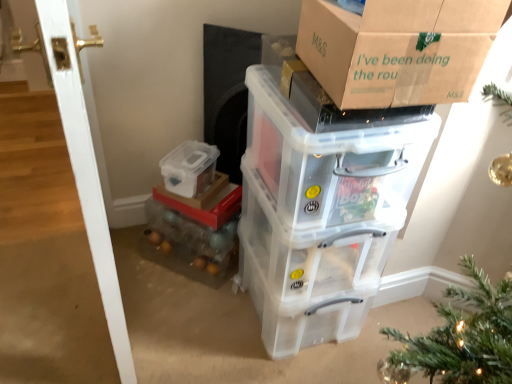
Question: Which direction should I rotate to look at transparent plastic storage box at lower center, which ranks as the 3th storage box in bottom-to-top order, — up or down?

Choices:
 (A) down
 (B) up

Answer: (B)

Question: From a real-world perspective, is transparent plastic storage box at center, which is the 4th storage box in top-to-bottom order, physically below white glossy door at left?

Choices:
 (A) yes
 (B) no

Answer: (A)

Question: From the image's perspective, is transparent plastic storage box at center, which is counted as the first storage box, starting from the bottom, below white glossy door at left?

Choices:
 (A) yes
 (B) no

Answer: (A)

Question: Is transparent plastic storage box at center, which is the 4th storage box in top-to-bottom order, shorter than white glossy door at left?

Choices:
 (A) no
 (B) yes

Answer: (B)

Question: From a real-world perspective, is transparent plastic storage box at center, which is counted as the first storage box, starting from the bottom, positioned over white glossy door at left based on gravity?

Choices:
 (A) no
 (B) yes

Answer: (A)

Question: Can we say transparent plastic storage box at center, which is counted as the first storage box, starting from the bottom, lies outside white glossy door at left?

Choices:
 (A) no
 (B) yes

Answer: (B)

Question: Can you confirm if transparent plastic storage box at center, which is counted as the first storage box, starting from the bottom, is bigger than white glossy door at left?

Choices:
 (A) yes
 (B) no

Answer: (B)

Question: Considering the relative sizes of transparent plastic storage box at upper right, acting as the first storage box starting from the top, and transparent plastic storage box at center, which is the 4th storage box in top-to-bottom order, in the image provided, is transparent plastic storage box at upper right, acting as the first storage box starting from the top, bigger than transparent plastic storage box at center, which is the 4th storage box in top-to-bottom order,?

Choices:
 (A) yes
 (B) no

Answer: (A)

Question: From the image's perspective, is transparent plastic storage box at upper right, marked as the fourth storage box in a bottom-to-top arrangement, under transparent plastic storage box at center, which is counted as the first storage box, starting from the bottom?

Choices:
 (A) no
 (B) yes

Answer: (A)

Question: Could you tell me if transparent plastic storage box at upper right, acting as the first storage box starting from the top, is turned towards transparent plastic storage box at center, which is the 4th storage box in top-to-bottom order?

Choices:
 (A) yes
 (B) no

Answer: (B)

Question: Is transparent plastic storage box at center, which is the 4th storage box in top-to-bottom order, at the back of transparent plastic storage box at upper right, acting as the first storage box starting from the top?

Choices:
 (A) yes
 (B) no

Answer: (B)

Question: Is transparent plastic storage box at upper right, marked as the fourth storage box in a bottom-to-top arrangement, next to transparent plastic storage box at center, which is counted as the first storage box, starting from the bottom, and touching it?

Choices:
 (A) yes
 (B) no

Answer: (B)

Question: Does transparent plastic storage box at upper right, acting as the first storage box starting from the top, have a lesser width compared to transparent plastic storage box at center, which is the 4th storage box in top-to-bottom order?

Choices:
 (A) yes
 (B) no

Answer: (B)

Question: Does translucent plastic storage box at lower center, the second storage box ordered from the bottom, lie behind transparent plastic storage box at upper right, acting as the first storage box starting from the top?

Choices:
 (A) yes
 (B) no

Answer: (A)